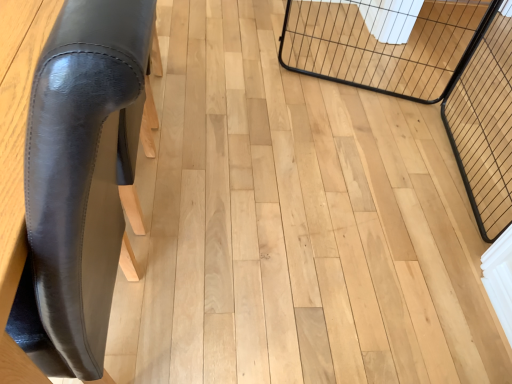
The width and height of the screenshot is (512, 384). Describe the element at coordinates (384, 43) in the screenshot. I see `black wire cage at upper right, the second cage in the right-to-left sequence` at that location.

What do you see at coordinates (452, 104) in the screenshot? I see `black wire mesh cage at right, the second cage in the left-to-right sequence` at bounding box center [452, 104].

Locate an element on the screen. This screenshot has height=384, width=512. black wire cage at upper right, the second cage in the right-to-left sequence is located at coordinates (384, 43).

How different are the orientations of black wire mesh cage at right, which ranks as the 1th cage in right-to-left order, and black leather chair at left in degrees?

179 degrees separate the facing orientations of black wire mesh cage at right, which ranks as the 1th cage in right-to-left order, and black leather chair at left.

Based on the photo, considering the positions of objects black wire mesh cage at right, the second cage in the left-to-right sequence, and black leather chair at left in the image provided, who is behind, black wire mesh cage at right, the second cage in the left-to-right sequence, or black leather chair at left?

black wire mesh cage at right, the second cage in the left-to-right sequence, is further from the camera.

Considering the relative positions of black wire mesh cage at right, the second cage in the left-to-right sequence, and black leather chair at left in the image provided, is black wire mesh cage at right, the second cage in the left-to-right sequence, to the left or to the right of black leather chair at left?

black wire mesh cage at right, the second cage in the left-to-right sequence, is positioned on black leather chair at left's right side.

Who is bigger, black wire mesh cage at right, the second cage in the left-to-right sequence, or black leather chair at left?

Bigger between the two is black leather chair at left.

From the picture: Would you say black wire mesh cage at right, the second cage in the left-to-right sequence, is outside black wire cage at upper right, the second cage in the right-to-left sequence?

Yes.

Is black wire mesh cage at right, the second cage in the left-to-right sequence, far away from black wire cage at upper right, the second cage in the right-to-left sequence?

black wire mesh cage at right, the second cage in the left-to-right sequence, is actually quite close to black wire cage at upper right, the second cage in the right-to-left sequence.

Is black wire mesh cage at right, which ranks as the 1th cage in right-to-left order, closer to camera compared to black wire cage at upper right, acting as the 1th cage starting from the left?

That is True.

Which point is more distant from viewer, (480, 33) or (431, 31)?

The point (480, 33) is more distant.

Who is shorter, black wire cage at upper right, acting as the 1th cage starting from the left, or black wire mesh cage at right, the second cage in the left-to-right sequence?

black wire mesh cage at right, the second cage in the left-to-right sequence.

The height and width of the screenshot is (384, 512). Identify the location of cage to the left of black wire mesh cage at right, which ranks as the 1th cage in right-to-left order. (384, 43).

Is black wire cage at upper right, acting as the 1th cage starting from the left, oriented away from black wire mesh cage at right, which ranks as the 1th cage in right-to-left order?

No, black wire cage at upper right, acting as the 1th cage starting from the left, is not facing away from black wire mesh cage at right, which ranks as the 1th cage in right-to-left order.

Which object is positioned more to the left, black wire cage at upper right, the second cage in the right-to-left sequence, or black wire mesh cage at right, which ranks as the 1th cage in right-to-left order?

Positioned to the left is black wire cage at upper right, the second cage in the right-to-left sequence.

Measure the distance between black wire cage at upper right, acting as the 1th cage starting from the left, and black leather chair at left.

The distance of black wire cage at upper right, acting as the 1th cage starting from the left, from black leather chair at left is 5.53 feet.

Is point (472, 24) closer to viewer compared to point (47, 211)?

No.

Could you tell me if black wire cage at upper right, acting as the 1th cage starting from the left, is facing black leather chair at left?

No.

Is black wire cage at upper right, the second cage in the right-to-left sequence, directly adjacent to black leather chair at left?

No, black wire cage at upper right, the second cage in the right-to-left sequence, is not in contact with black leather chair at left.

From a real-world perspective, which object rests below the other?

black wire cage at upper right, the second cage in the right-to-left sequence, is physically lower.

Does black leather chair at left lie behind black wire cage at upper right, acting as the 1th cage starting from the left?

No, black leather chair at left is in front of black wire cage at upper right, acting as the 1th cage starting from the left.

Is black leather chair at left aimed at black wire cage at upper right, acting as the 1th cage starting from the left?

Yes, black leather chair at left is facing black wire cage at upper right, acting as the 1th cage starting from the left.

Measure the distance between black leather chair at left and black wire cage at upper right, acting as the 1th cage starting from the left.

5.53 feet.

Between black leather chair at left and black wire mesh cage at right, which ranks as the 1th cage in right-to-left order, which one is positioned in front?

Positioned in front is black leather chair at left.

Is black leather chair at left oriented towards black wire mesh cage at right, the second cage in the left-to-right sequence?

Yes, black leather chair at left is oriented towards black wire mesh cage at right, the second cage in the left-to-right sequence.

Find the location of a particular element. The width and height of the screenshot is (512, 384). cage that is the 1st object located above the black leather chair at left (from the image's perspective) is located at coordinates (452, 104).

Would you say black wire mesh cage at right, the second cage in the left-to-right sequence, is part of black leather chair at left's contents?

Actually, black wire mesh cage at right, the second cage in the left-to-right sequence, is outside black leather chair at left.

You are a GUI agent. You are given a task and a screenshot of the screen. Output one action in this format:
    pyautogui.click(x=<x>, y=<y>)
    Task: Click on the furniture above the black wire mesh cage at right, the second cage in the left-to-right sequence (from a real-world perspective)
    The image size is (512, 384).
    Given the screenshot: What is the action you would take?
    pyautogui.click(x=81, y=181)

You are a GUI agent. You are given a task and a screenshot of the screen. Output one action in this format:
    pyautogui.click(x=<x>, y=<y>)
    Task: Click on the cage lying on the right of black wire cage at upper right, the second cage in the right-to-left sequence
    This screenshot has width=512, height=384.
    Given the screenshot: What is the action you would take?
    pyautogui.click(x=452, y=104)

From the image, which object appears to be farther from black leather chair at left, black wire mesh cage at right, which ranks as the 1th cage in right-to-left order, or black wire cage at upper right, acting as the 1th cage starting from the left?

black wire cage at upper right, acting as the 1th cage starting from the left, is positioned further to the anchor black leather chair at left.

Looking at the image, which one is located further to black wire mesh cage at right, which ranks as the 1th cage in right-to-left order, black leather chair at left or black wire cage at upper right, acting as the 1th cage starting from the left?

black leather chair at left is positioned further to the anchor black wire mesh cage at right, which ranks as the 1th cage in right-to-left order.

Estimate the real-world distances between objects in this image. Which object is closer to black wire cage at upper right, the second cage in the right-to-left sequence, black wire mesh cage at right, the second cage in the left-to-right sequence, or black leather chair at left?

Based on the image, black wire mesh cage at right, the second cage in the left-to-right sequence, appears to be nearer to black wire cage at upper right, the second cage in the right-to-left sequence.

Which object lies further to the anchor point black wire mesh cage at right, which ranks as the 1th cage in right-to-left order, black wire cage at upper right, the second cage in the right-to-left sequence, or black leather chair at left?

black leather chair at left.

Which object lies further to the anchor point black leather chair at left, black wire cage at upper right, acting as the 1th cage starting from the left, or black wire mesh cage at right, the second cage in the left-to-right sequence?

black wire cage at upper right, acting as the 1th cage starting from the left, is further to black leather chair at left.

Based on their spatial positions, is black leather chair at left or black wire mesh cage at right, the second cage in the left-to-right sequence, closer to black wire cage at upper right, acting as the 1th cage starting from the left?

black wire mesh cage at right, the second cage in the left-to-right sequence, lies closer to black wire cage at upper right, acting as the 1th cage starting from the left, than the other object.

Locate an element on the screen. cage situated between black leather chair at left and black wire mesh cage at right, which ranks as the 1th cage in right-to-left order, from left to right is located at coordinates (384, 43).